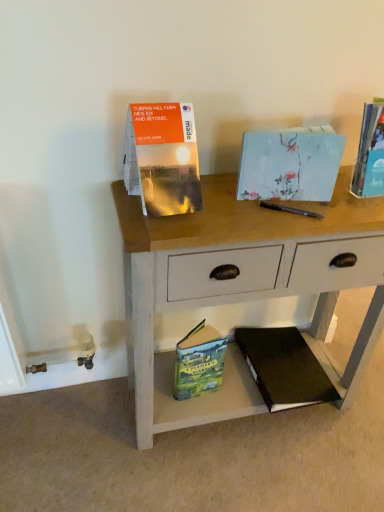
Question: Considering the relative sizes of light blue paper at center, the second paperback book from the top, and matte orange map at upper left, the third paperback book positioned from the bottom, in the image provided, is light blue paper at center, the second paperback book from the top, thinner than matte orange map at upper left, the third paperback book positioned from the bottom,?

Choices:
 (A) yes
 (B) no

Answer: (A)

Question: Can you confirm if light blue paper at center, the 4th paperback book from the bottom, is smaller than matte orange map at upper left, the third paperback book positioned from the bottom?

Choices:
 (A) no
 (B) yes

Answer: (B)

Question: Can you confirm if light blue paper at center, the second paperback book from the top, is shorter than matte orange map at upper left, the third paperback book positioned from the bottom?

Choices:
 (A) no
 (B) yes

Answer: (B)

Question: From the image's perspective, is light blue paper at center, the second paperback book from the top, below matte orange map at upper left, the 3th paperback book positioned from the top?

Choices:
 (A) no
 (B) yes

Answer: (A)

Question: Can matte orange map at upper left, the third paperback book positioned from the bottom, be found inside light blue paper at center, the second paperback book from the top?

Choices:
 (A) yes
 (B) no

Answer: (B)

Question: From the image's perspective, is wooden desk at center located above or below black hardcover book at lower right, the fifth paperback book viewed from the top?

Choices:
 (A) above
 (B) below

Answer: (A)

Question: From a real-world perspective, is wooden desk at center physically located above or below black hardcover book at lower right, arranged as the 1th paperback book when ordered from the bottom?

Choices:
 (A) below
 (B) above

Answer: (B)

Question: Based on their sizes in the image, would you say wooden desk at center is bigger or smaller than black hardcover book at lower right, the fifth paperback book viewed from the top?

Choices:
 (A) big
 (B) small

Answer: (A)

Question: Considering the positions of wooden desk at center and black hardcover book at lower right, arranged as the 1th paperback book when ordered from the bottom, in the image, is wooden desk at center wider or thinner than black hardcover book at lower right, arranged as the 1th paperback book when ordered from the bottom,?

Choices:
 (A) wide
 (B) thin

Answer: (B)

Question: In terms of height, does matte orange map at upper left, the 3th paperback book positioned from the top, look taller or shorter compared to hardcover book at upper right, positioned as the first paperback book in top-to-bottom order?

Choices:
 (A) short
 (B) tall

Answer: (B)

Question: From the image's perspective, relative to hardcover book at upper right, positioned as the first paperback book in top-to-bottom order, is matte orange map at upper left, the 3th paperback book positioned from the top, above or below?

Choices:
 (A) above
 (B) below

Answer: (B)

Question: Is matte orange map at upper left, the 3th paperback book positioned from the top, inside or outside of hardcover book at upper right, positioned as the first paperback book in top-to-bottom order?

Choices:
 (A) inside
 (B) outside

Answer: (B)

Question: In the image, is matte orange map at upper left, the third paperback book positioned from the bottom, positioned in front of or behind hardcover book at upper right, positioned as the first paperback book in top-to-bottom order?

Choices:
 (A) front
 (B) behind

Answer: (A)

Question: Would you say hardcover book at upper right, the 5th paperback book when ordered from bottom to top, is to the left or to the right of wooden desk at center in the picture?

Choices:
 (A) left
 (B) right

Answer: (B)

Question: From the image's perspective, is hardcover book at upper right, the 5th paperback book when ordered from bottom to top, positioned above or below wooden desk at center?

Choices:
 (A) below
 (B) above

Answer: (B)